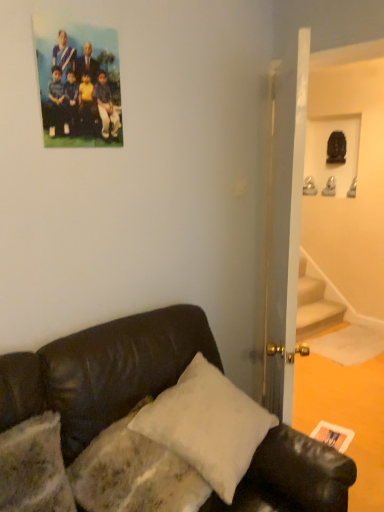
Question: In the image, is black leather couch at lower left on the left side or the right side of white matte postcard at lower right?

Choices:
 (A) left
 (B) right

Answer: (A)

Question: In terms of height, does black leather couch at lower left look taller or shorter compared to white matte postcard at lower right?

Choices:
 (A) short
 (B) tall

Answer: (B)

Question: Estimate the real-world distances between objects in this image. Which object is closer to the white soft pillow at lower center?

Choices:
 (A) white matte postcard at lower right
 (B) black leather couch at lower left
 (C) matte plastic photo at upper left

Answer: (B)

Question: Considering the real-world distances, which object is closest to the white matte postcard at lower right?

Choices:
 (A) matte plastic photo at upper left
 (B) black leather couch at lower left
 (C) white soft pillow at lower center

Answer: (B)